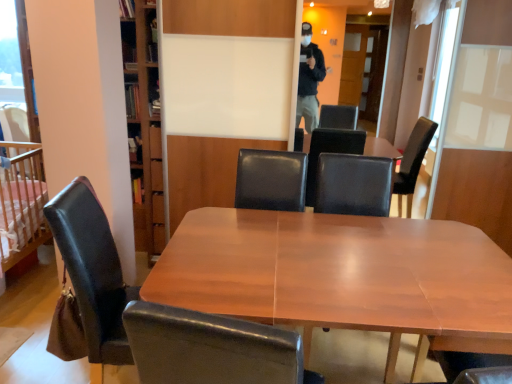
Question: Considering the positions of point (88, 289) and point (65, 349), is point (88, 289) closer or farther from the camera than point (65, 349)?

Choices:
 (A) farther
 (B) closer

Answer: (B)

Question: From the image's perspective, relative to leather at left, marked as the second chair in a left-to-right arrangement, is black leather chair at left, which is the 2th chair from front to back, above or below?

Choices:
 (A) below
 (B) above

Answer: (B)

Question: Based on their relative distances, which object is nearer to the black leather armchair at center?

Choices:
 (A) black leather chair at left, which is the 2th chair from front to back
 (B) wooden crib at left
 (C) wooden table at center
 (D) leather at left, which is counted as the first chair, starting from the front

Answer: (C)

Question: Based on their relative distances, which object is farther from the black leather chair at left, the second chair from the right?

Choices:
 (A) leather at left, the 1th chair when ordered from right to left
 (B) black leather armchair at center
 (C) wooden crib at left
 (D) wooden table at center

Answer: (B)